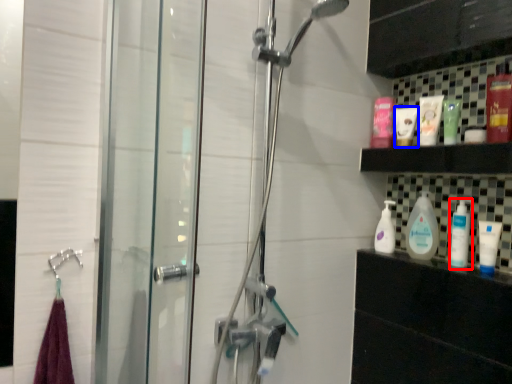
Question: Which point is closer to the camera, cleaning product (highlighted by a red box) or toiletry (highlighted by a blue box)?

Choices:
 (A) cleaning product
 (B) toiletry

Answer: (A)